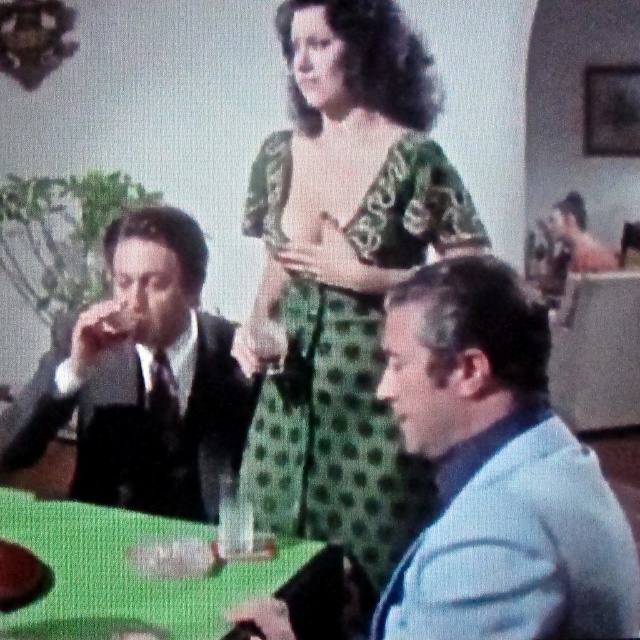
Question: Is green dotted fabric dress at center to the left of green glossy table at lower center from the viewer's perspective?

Choices:
 (A) no
 (B) yes

Answer: (A)

Question: Does green dotted fabric dress at center appear over shiny black suit at left?

Choices:
 (A) no
 (B) yes

Answer: (B)

Question: Is light blue fabric jacket at center to the left of green dotted fabric dress at center from the viewer's perspective?

Choices:
 (A) yes
 (B) no

Answer: (B)

Question: Which object appears closest to the camera in this image?

Choices:
 (A) green dotted fabric dress at center
 (B) green glossy table at lower center

Answer: (B)

Question: Which object is farther from the camera taking this photo?

Choices:
 (A) shiny black suit at left
 (B) green dotted fabric dress at center

Answer: (A)

Question: Considering the real-world distances, which object is closest to the shiny black suit at left?

Choices:
 (A) light blue fabric jacket at center
 (B) green dotted fabric dress at center
 (C) green glossy table at lower center

Answer: (B)